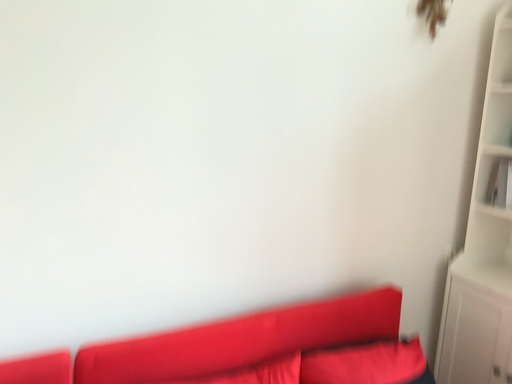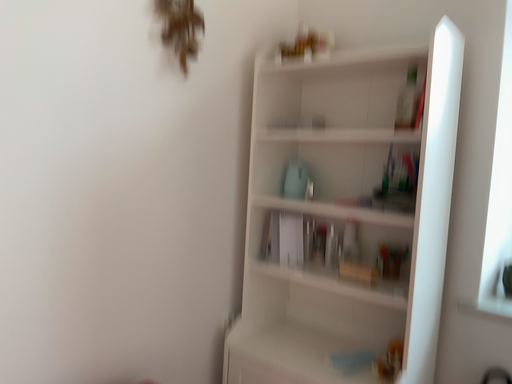
Question: How did the camera likely rotate when shooting the video?

Choices:
 (A) rotated right
 (B) rotated left

Answer: (A)